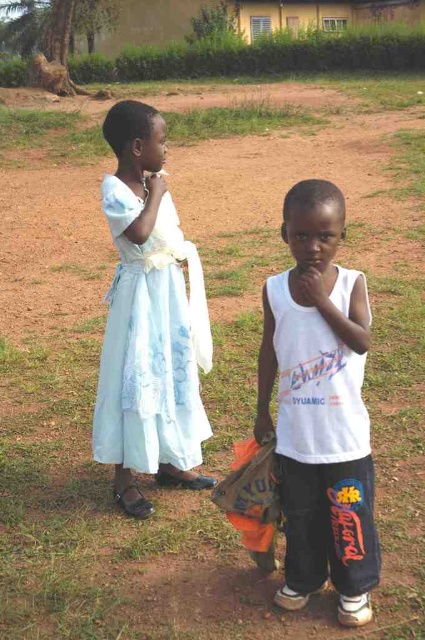
Question: Does white cotton tank top at center appear under light blue satin dress at left?

Choices:
 (A) yes
 (B) no

Answer: (A)

Question: Is white cotton tank top at center above light blue satin dress at left?

Choices:
 (A) no
 (B) yes

Answer: (A)

Question: Which point is closer to the camera?

Choices:
 (A) light blue satin dress at left
 (B) white cotton tank top at center

Answer: (B)

Question: Among these points, which one is nearest to the camera?

Choices:
 (A) (119, 211)
 (B) (333, 376)

Answer: (B)

Question: Where is white cotton tank top at center located in relation to light blue satin dress at left in the image?

Choices:
 (A) left
 (B) right

Answer: (B)